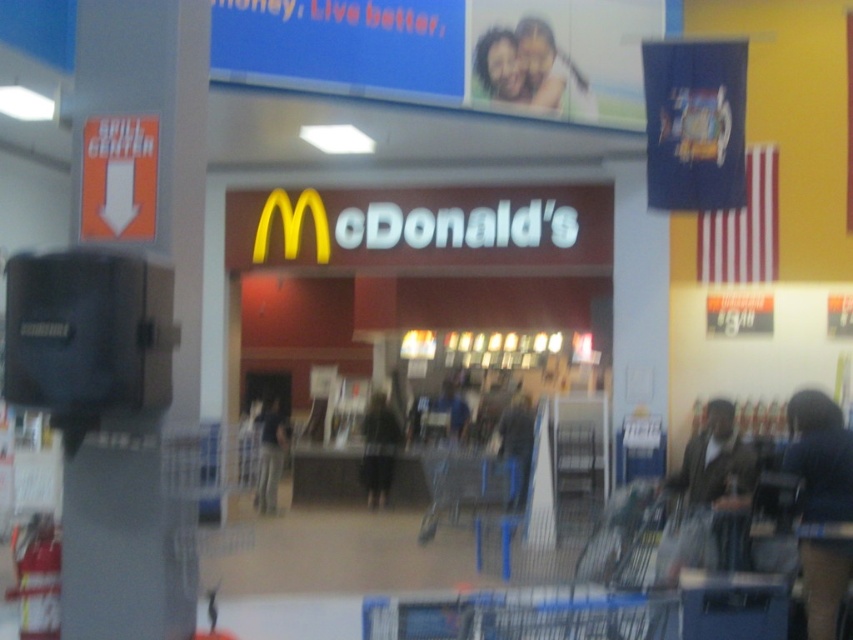
You are standing at the entrance of the McDonalds restaurant in the shopping mall. You see a black fuzzy coat at center. Where is the black fuzzy coat in relation to the McDonalds entrance?

The black fuzzy coat at center is located at point (379, 449), which is to the right of the McDonalds entrance.